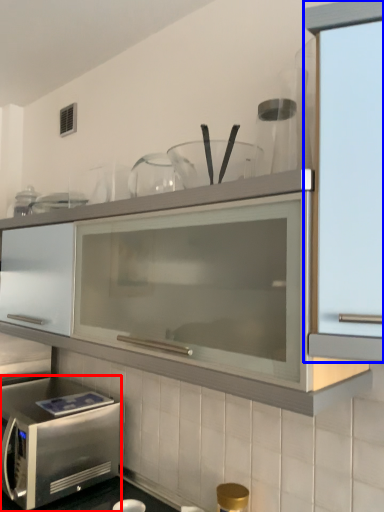
Question: Which object is further to the camera taking this photo, microwave oven (highlighted by a red box) or cabinetry (highlighted by a blue box)?

Choices:
 (A) microwave oven
 (B) cabinetry

Answer: (A)